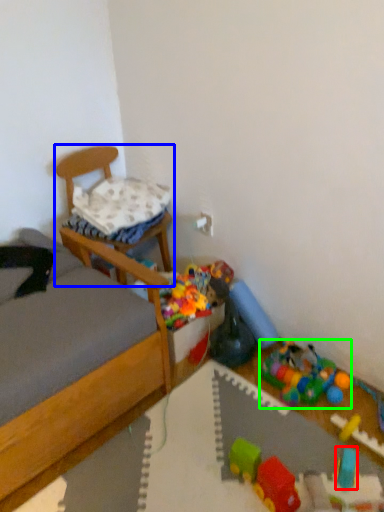
Question: Based on their relative distances, which object is farther from toy (highlighted by a red box)? Choose from chair (highlighted by a blue box) and toy (highlighted by a green box).

Choices:
 (A) chair
 (B) toy

Answer: (A)